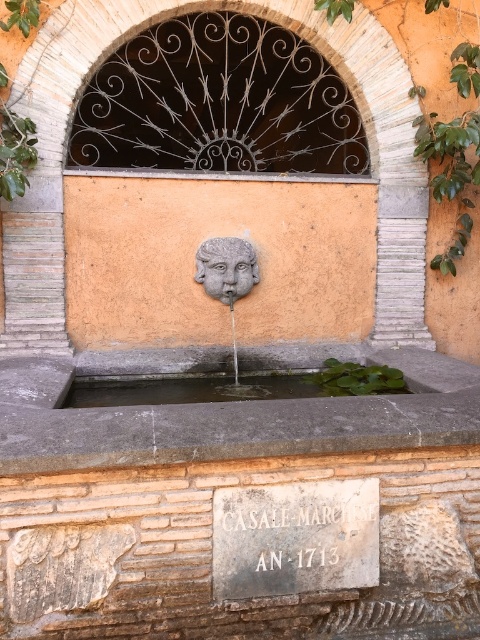
You are an architect analyzing the structural integrity of the dark wrought iron arch at upper center. Based on its position relative to the fountain and the wall, can you determine if it is centered horizontally over the fountain?

The dark wrought iron arch at upper center is located at point coordinates that do not provide enough information about its horizontal alignment relative to the fountain. The question cannot be answered with the given data.

You are standing in front of the fountain and want to locate the dark wrought iron arch at upper center. According to the coordinates provided, where would you look relative to the center of the image?

The dark wrought iron arch at upper center is located at coordinates point (x=217, y=104), which means it is positioned slightly to the left and above the center of the image.

You are an architect examining the historical fountain. You need to determine the spatial relationship between the dark wrought iron arch at upper center and the clear water at center. Which one has a greater height in the image?

The dark wrought iron arch at upper center is taller than the clear water at center according to the description.